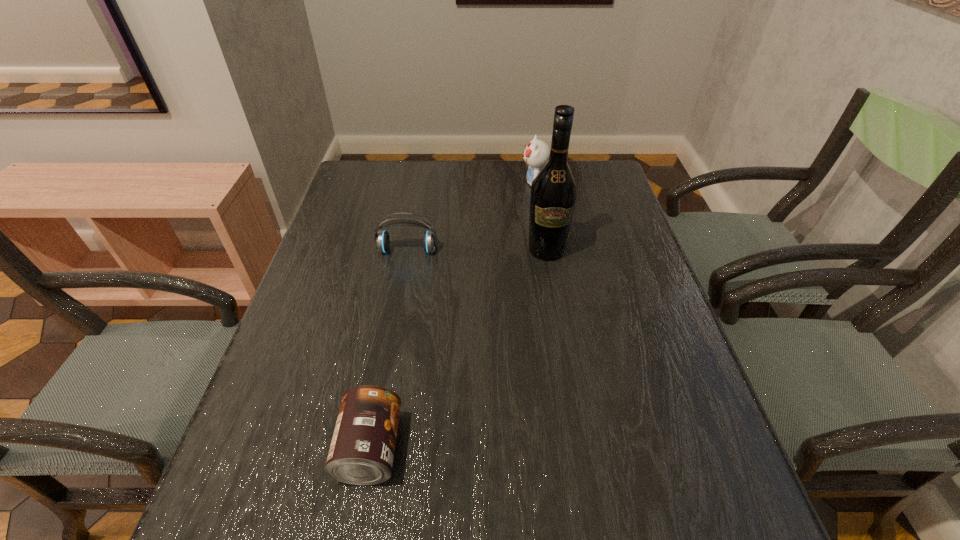
Identify the location of the tallest object. This screenshot has height=540, width=960. (553, 196).

I want to click on the second tallest object, so click(x=536, y=153).

Locate an element on the screen. the farthest object is located at coordinates 536,153.

The width and height of the screenshot is (960, 540). Find the location of `headset`. headset is located at coordinates (382, 241).

This screenshot has height=540, width=960. Find the location of `the nearest object`. the nearest object is located at coordinates (362, 449).

At what (x,y) coordinates should I click in order to perform the action: click on vacant space positioned 0.060m on the label of the wine bottle. Please return your answer as a coordinate pair (x, y). This screenshot has width=960, height=540. Looking at the image, I should click on (551, 280).

Find the location of `blank space located on the front-facing side of the kitten`. blank space located on the front-facing side of the kitten is located at coordinates (441, 182).

The image size is (960, 540). I want to click on vacant area situated on the front-facing side of the kitten, so click(x=492, y=182).

The width and height of the screenshot is (960, 540). I want to click on vacant space located on the front-facing side of the kitten, so click(495, 182).

Where is `free space located on the ear cups of the headset`? free space located on the ear cups of the headset is located at coordinates (392, 338).